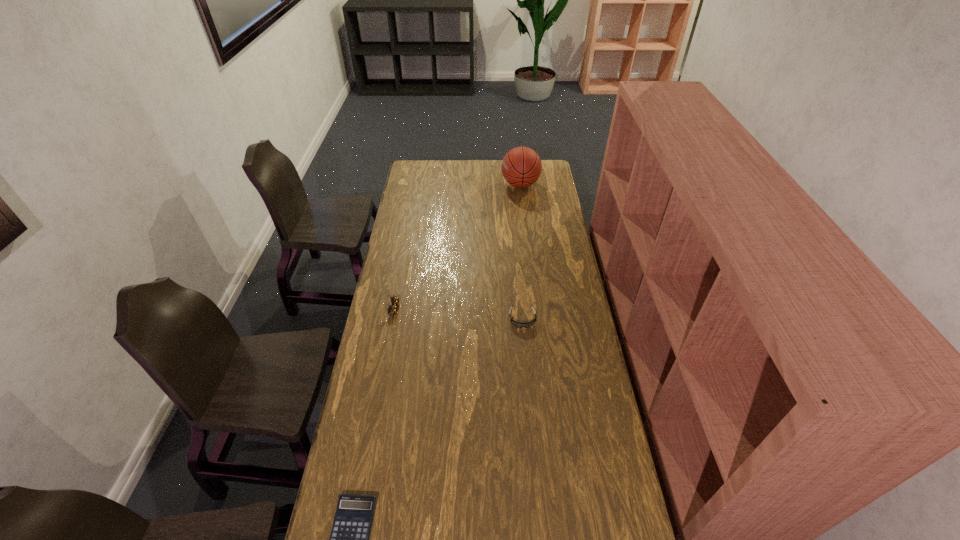
Where is `basketball`? basketball is located at coordinates (521, 167).

Locate an element on the screen. This screenshot has width=960, height=540. the tallest object is located at coordinates (521, 167).

What are the coordinates of `the left goggles` in the screenshot? It's located at (392, 309).

Find the location of a particular element. the second tallest object is located at coordinates (392, 309).

Locate an element on the screen. the right goggles is located at coordinates (517, 324).

Where is `the shorter goggles`? The image size is (960, 540). the shorter goggles is located at coordinates (517, 324).

I want to click on vacant point located on the logo side of the basketball, so click(467, 185).

At what (x,y) coordinates should I click in order to perform the action: click on vacant region located 0.080m on the logo side of the basketball. Please return your answer as a coordinate pair (x, y). The height and width of the screenshot is (540, 960). Looking at the image, I should click on (487, 185).

You are a GUI agent. You are given a task and a screenshot of the screen. Output one action in this format:
    pyautogui.click(x=<x>, y=<y>)
    Task: Click on the vacant area situated on the logo side of the basketball
    
    Given the screenshot: What is the action you would take?
    pyautogui.click(x=486, y=185)

You are a GUI agent. You are given a task and a screenshot of the screen. Output one action in this format:
    pyautogui.click(x=<x>, y=<y>)
    Task: Click on the free space located 0.130m through the lenses of the third shortest object
    Image resolution: width=960 pixels, height=540 pixels.
    Given the screenshot: What is the action you would take?
    pyautogui.click(x=429, y=309)